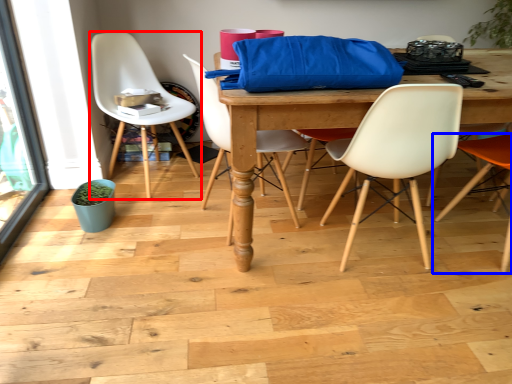
Question: Among these objects, which one is nearest to the camera, chair (highlighted by a red box) or chair (highlighted by a blue box)?

Choices:
 (A) chair
 (B) chair

Answer: (B)